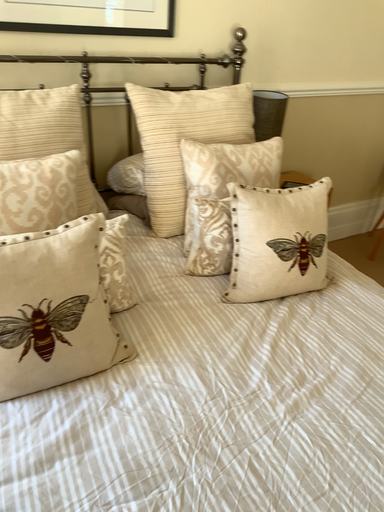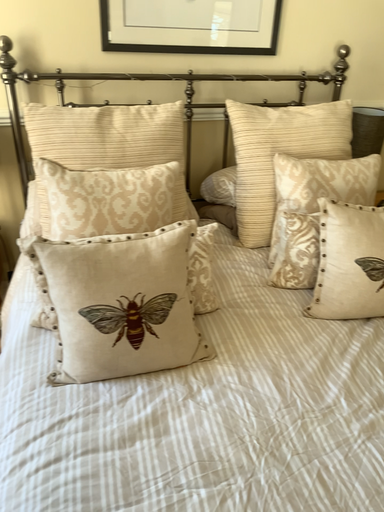
Question: How did the camera likely rotate when shooting the video?

Choices:
 (A) rotated right
 (B) rotated left

Answer: (B)